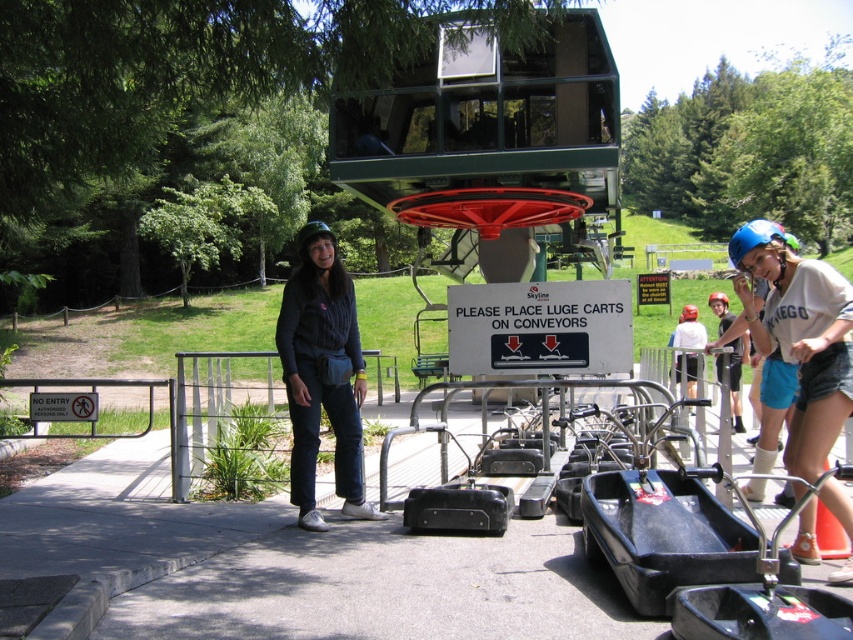
You are a safety inspector checking the luge track area. You notice the blue matte helmet at upper right and the white plastic sign at center. Which object is taller?

The blue matte helmet at upper right is taller than the white plastic sign at center.

You are a luge cart operator and need to place two carts at the two points provided. The carts are 1 meter long. The first cart must be placed at point (x=322, y=323) and the second at point (x=521, y=346). Given that the track has a minimum distance requirement of 2 meters between carts for safety, will the carts be placed safely apart?

Point (x=322, y=323) is closer to the viewer than point (x=521, y=346). Since the carts are placed along the track, the distance between them would be greater than 2 meters because the second point is further away. Therefore, the carts will be safely placed apart.